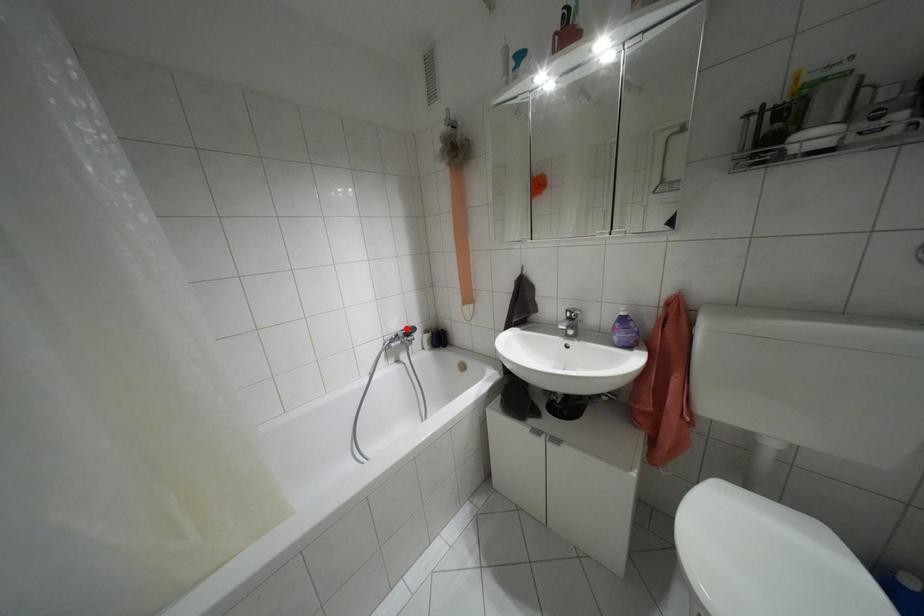
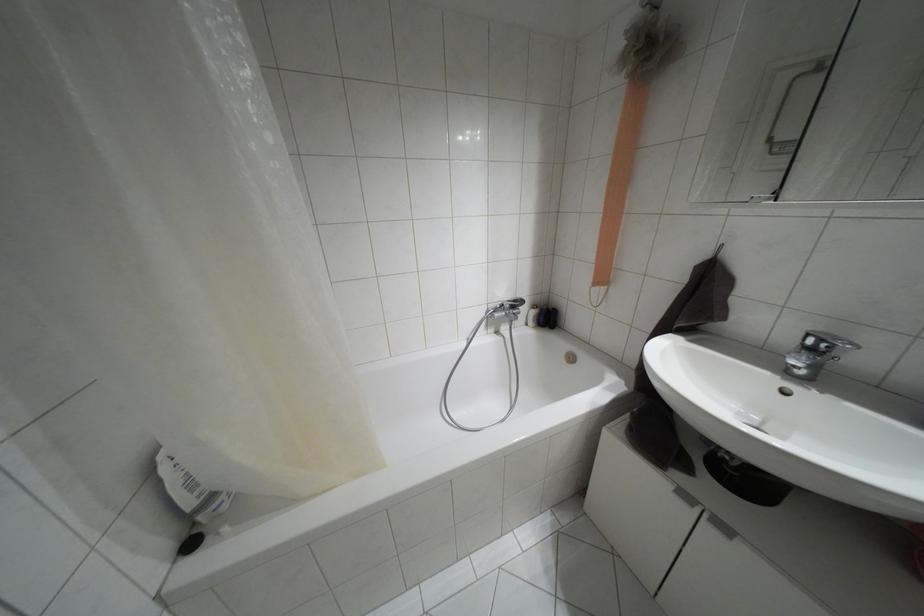
Find the pixel in the second image that matches the highlighted location in the first image.

(514, 301)